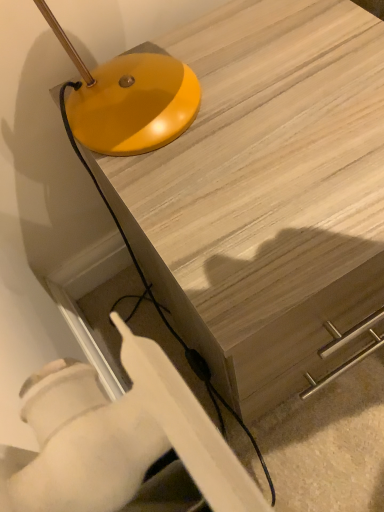
The height and width of the screenshot is (512, 384). Identify the location of vacant region below matte yellow lampshade at upper left (from a real-world perspective). (148, 93).